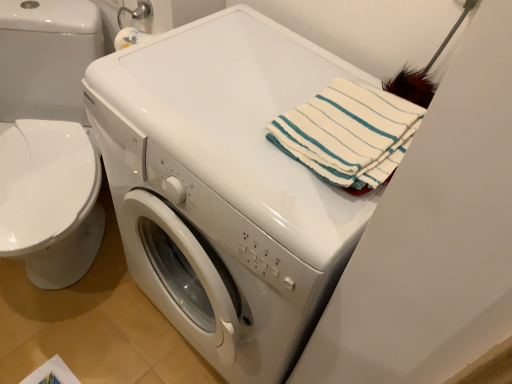
Question: From a real-world perspective, is white glossy washing machine at center physically above white glossy washer at left?

Choices:
 (A) yes
 (B) no

Answer: (A)

Question: From the image's perspective, is white glossy washing machine at center on white glossy washer at left?

Choices:
 (A) yes
 (B) no

Answer: (B)

Question: Is white glossy washing machine at center placed right next to white glossy washer at left?

Choices:
 (A) no
 (B) yes

Answer: (A)

Question: Is white glossy washing machine at center oriented towards white glossy washer at left?

Choices:
 (A) yes
 (B) no

Answer: (B)

Question: Is white glossy washing machine at center thinner than white glossy washer at left?

Choices:
 (A) yes
 (B) no

Answer: (A)

Question: Is white glossy washing machine at center shorter than white glossy washer at left?

Choices:
 (A) yes
 (B) no

Answer: (B)

Question: Is white glossy washer at left to the left of white glossy washing machine at center from the viewer's perspective?

Choices:
 (A) yes
 (B) no

Answer: (A)

Question: Does white glossy washer at left contain white glossy washing machine at center?

Choices:
 (A) yes
 (B) no

Answer: (B)

Question: Considering the relative sizes of white glossy washer at left and white glossy washing machine at center in the image provided, is white glossy washer at left shorter than white glossy washing machine at center?

Choices:
 (A) yes
 (B) no

Answer: (A)

Question: Considering the relative sizes of white glossy washer at left and white glossy washing machine at center in the image provided, is white glossy washer at left wider than white glossy washing machine at center?

Choices:
 (A) yes
 (B) no

Answer: (A)

Question: Would you say white glossy washer at left is outside white glossy washing machine at center?

Choices:
 (A) no
 (B) yes

Answer: (B)

Question: Is white glossy washer at left to the right of white glossy washing machine at center from the viewer's perspective?

Choices:
 (A) yes
 (B) no

Answer: (B)

Question: Does white glossy washing machine at center have a lesser width compared to white striped towel at upper right?

Choices:
 (A) yes
 (B) no

Answer: (B)